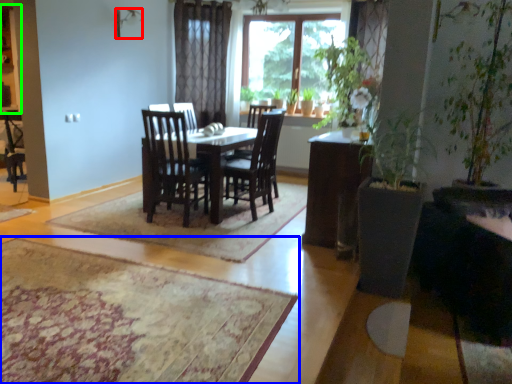
Question: Which is farther away from lamp (highlighted by a red box)? mat (highlighted by a blue box) or cabinetry (highlighted by a green box)?

Choices:
 (A) mat
 (B) cabinetry

Answer: (A)